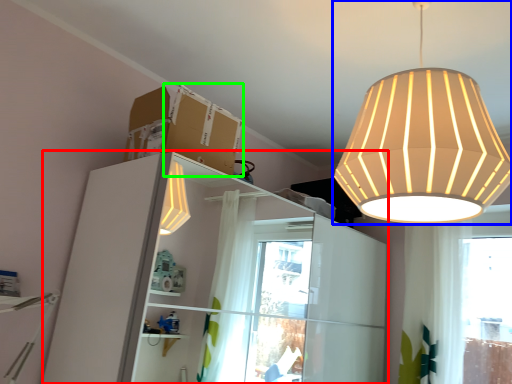
Question: Which object is the farthest from dresser (highlighted by a red box)? Choose among these: lamp (highlighted by a blue box) or cardboard box (highlighted by a green box).

Choices:
 (A) lamp
 (B) cardboard box

Answer: (A)